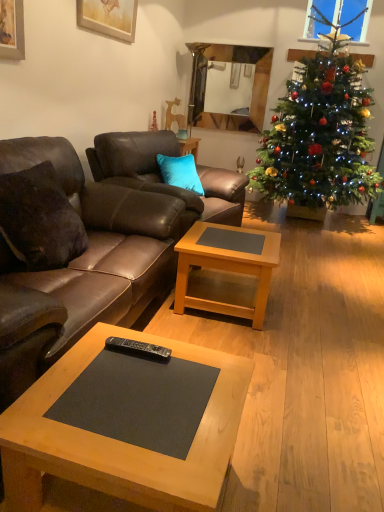
This screenshot has width=384, height=512. What are the coordinates of `vacant space to the left of black plastic remote control at center` in the screenshot? It's located at (92, 353).